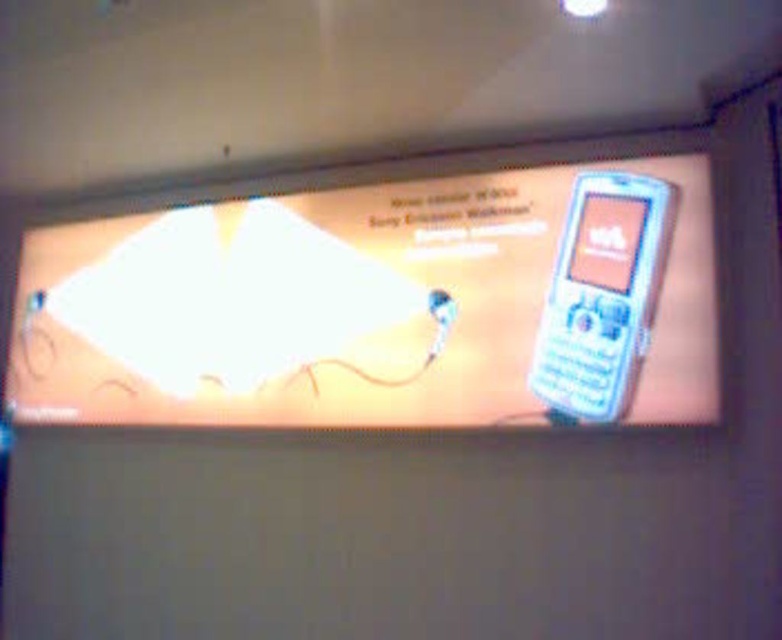
Based on the photo, you are designing a mobile phone advertisement and want to place two white plastic phones. The scene shows a white plastic phone at center and a white plastic phone at right. Which phone has a greater width?

The white plastic phone at center has a greater width than the white plastic phone at right.